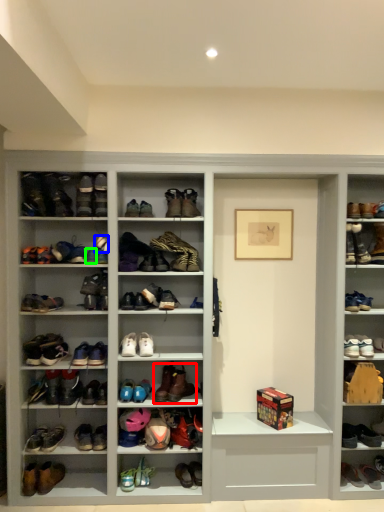
Question: Which object is positioned closest to footwear (highlighted by a red box)? Select from shoe (highlighted by a blue box) and shoe (highlighted by a green box).

Choices:
 (A) shoe
 (B) shoe

Answer: (B)